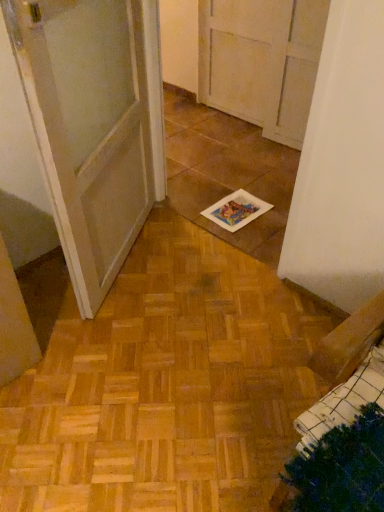
You are a GUI agent. You are given a task and a screenshot of the screen. Output one action in this format:
    pyautogui.click(x=<x>, y=<y>)
    Task: Click on the vacant region above white paper at center (from a real-world perspective)
    The height and width of the screenshot is (512, 384).
    Given the screenshot: What is the action you would take?
    pyautogui.click(x=238, y=207)